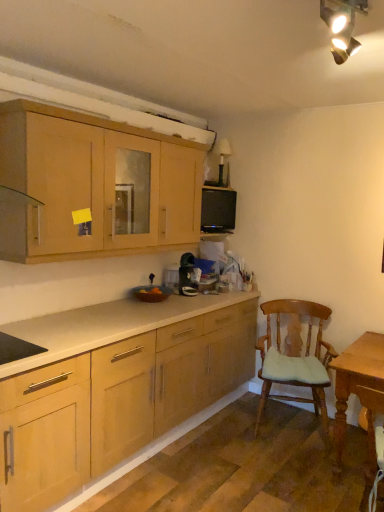
Measure the distance between matte wood cabinets at upper left and camera.

They are 6.96 feet apart.

Describe the element at coordinates (218, 210) in the screenshot. I see `black matte microwave at upper center` at that location.

You are a GUI agent. You are given a task and a screenshot of the screen. Output one action in this format:
    pyautogui.click(x=<x>, y=<y>)
    Task: Click on the matte wood cabinets at upper left
    
    Given the screenshot: What is the action you would take?
    pyautogui.click(x=94, y=186)

Considering the relative positions of black matte microwave at upper center and light brown wooden table at lower right in the image provided, is black matte microwave at upper center behind light brown wooden table at lower right?

Yes, it is.

Would you say black matte microwave at upper center contains light brown wooden table at lower right?

That's incorrect, light brown wooden table at lower right is not inside black matte microwave at upper center.

Would you consider black matte microwave at upper center to be distant from light brown wooden table at lower right?

Yes, black matte microwave at upper center and light brown wooden table at lower right are quite far apart.

Considering the positions of objects black matte microwave at upper center and light brown wooden table at lower right in the image provided, who is more to the left, black matte microwave at upper center or light brown wooden table at lower right?

black matte microwave at upper center is more to the left.

Considering the positions of point (334, 470) and point (230, 224), is point (334, 470) closer or farther from the camera than point (230, 224)?

Point (334, 470) is positioned closer to the camera compared to point (230, 224).

Measure the distance between light brown wooden table at lower right and black matte microwave at upper center.

light brown wooden table at lower right and black matte microwave at upper center are 1.65 meters apart.

From the image's perspective, which is above, light brown wooden table at lower right or black matte microwave at upper center?

From the image's view, black matte microwave at upper center is above.

Is light brown wooden table at lower right positioned in front of black matte microwave at upper center?

Yes, it is in front of black matte microwave at upper center.

Is matte wood cabinets at upper left positioned with its back to black matte microwave at upper center?

No, matte wood cabinets at upper left is not facing the opposite direction of black matte microwave at upper center.

Is matte wood cabinets at upper left at the right side of black matte microwave at upper center?

Incorrect, matte wood cabinets at upper left is not on the right side of black matte microwave at upper center.

Who is shorter, matte wood cabinets at upper left or black matte microwave at upper center?

black matte microwave at upper center is shorter.

Where is `cabinetry positioned vertically above the black matte microwave at upper center (from a real-world perspective)`? cabinetry positioned vertically above the black matte microwave at upper center (from a real-world perspective) is located at coordinates (94, 186).

Would you say matte wood cabinets at upper left is outside wooden cushioned chair at right?

matte wood cabinets at upper left lies outside wooden cushioned chair at right's area.

In the scene shown: Is wooden cushioned chair at right at the back of matte wood cabinets at upper left?

No.

Looking at this image, from the image's perspective, which is below, matte wood cabinets at upper left or wooden cushioned chair at right?

wooden cushioned chair at right is shown below in the image.

Between matte wood cabinets at upper left and wooden cushioned chair at right, which one has more height?

wooden cushioned chair at right.

Is black matte microwave at upper center in front of or behind wooden cushioned chair at right in the image?

Visually, black matte microwave at upper center is located behind wooden cushioned chair at right.

Between black matte microwave at upper center and wooden cushioned chair at right, which one appears on the left side from the viewer's perspective?

From the viewer's perspective, black matte microwave at upper center appears more on the left side.

Is black matte microwave at upper center taller than wooden cushioned chair at right?

Incorrect, the height of black matte microwave at upper center is not larger of that of wooden cushioned chair at right.

Is there a large distance between black matte microwave at upper center and wooden cushioned chair at right?

Yes, black matte microwave at upper center and wooden cushioned chair at right are quite far apart.

Measure the distance from light brown wooden table at lower right to wooden cushioned chair at right.

A distance of 19.03 inches exists between light brown wooden table at lower right and wooden cushioned chair at right.

Is light brown wooden table at lower right not near wooden cushioned chair at right?

No, there isn't a large distance between light brown wooden table at lower right and wooden cushioned chair at right.

From a real-world perspective, who is located lower, light brown wooden table at lower right or wooden cushioned chair at right?

light brown wooden table at lower right, from a real-world perspective.

Is light brown wooden table at lower right in front of wooden cushioned chair at right?

Yes, the depth of light brown wooden table at lower right is less than that of wooden cushioned chair at right.

Considering the sizes of objects wooden cushioned chair at right and light brown wooden table at lower right in the image provided, who is bigger, wooden cushioned chair at right or light brown wooden table at lower right?

wooden cushioned chair at right is bigger.

Which is nearer, (272, 348) or (372, 374)?

Clearly, point (272, 348) is more distant from the camera than point (372, 374).

Do you think wooden cushioned chair at right is within light brown wooden table at lower right, or outside of it?

wooden cushioned chair at right exists outside the volume of light brown wooden table at lower right.

Does wooden cushioned chair at right touch light brown wooden table at lower right?

wooden cushioned chair at right and light brown wooden table at lower right are not in contact.

The width and height of the screenshot is (384, 512). What are the coordinates of `table below the black matte microwave at upper center (from a real-world perspective)` in the screenshot? It's located at (355, 380).

This screenshot has height=512, width=384. Find the location of `table in front of the black matte microwave at upper center`. table in front of the black matte microwave at upper center is located at coordinates (355, 380).

When comparing their distances from matte wood cabinets at upper left, does black matte microwave at upper center or wooden cushioned chair at right seem closer?

The object closer to matte wood cabinets at upper left is black matte microwave at upper center.

Based on their spatial positions, is black matte microwave at upper center or light brown wooden table at lower right closer to wooden cushioned chair at right?

Based on the image, light brown wooden table at lower right appears to be nearer to wooden cushioned chair at right.

Which object lies nearer to the anchor point black matte microwave at upper center, wooden cushioned chair at right or light brown wooden table at lower right?

wooden cushioned chair at right is positioned closer to the anchor black matte microwave at upper center.

From the image, which object appears to be farther from wooden cushioned chair at right, black matte microwave at upper center or matte wood cabinets at upper left?

matte wood cabinets at upper left is positioned further to the anchor wooden cushioned chair at right.

Based on the photo, which object lies nearer to the anchor point wooden cushioned chair at right, light brown wooden table at lower right or black matte microwave at upper center?

light brown wooden table at lower right is positioned closer to the anchor wooden cushioned chair at right.

Consider the image. From the image, which object appears to be farther from black matte microwave at upper center, matte wood cabinets at upper left or light brown wooden table at lower right?

The object further to black matte microwave at upper center is light brown wooden table at lower right.

Which object lies further to the anchor point black matte microwave at upper center, light brown wooden table at lower right or wooden cushioned chair at right?

light brown wooden table at lower right is positioned further to the anchor black matte microwave at upper center.

Which object lies further to the anchor point black matte microwave at upper center, matte wood cabinets at upper left or wooden cushioned chair at right?

wooden cushioned chair at right is further to black matte microwave at upper center.

This screenshot has width=384, height=512. In order to click on chair between black matte microwave at upper center and light brown wooden table at lower right vertically in this screenshot , I will do `click(295, 358)`.

The image size is (384, 512). What are the coordinates of `appliance between matte wood cabinets at upper left and light brown wooden table at lower right from left to right` in the screenshot? It's located at (218, 210).

The image size is (384, 512). In order to click on chair between matte wood cabinets at upper left and black matte microwave at upper center in the front-back direction in this screenshot , I will do `click(295, 358)`.

Find the location of a particular element. chair between matte wood cabinets at upper left and light brown wooden table at lower right in the horizontal direction is located at coordinates (295, 358).